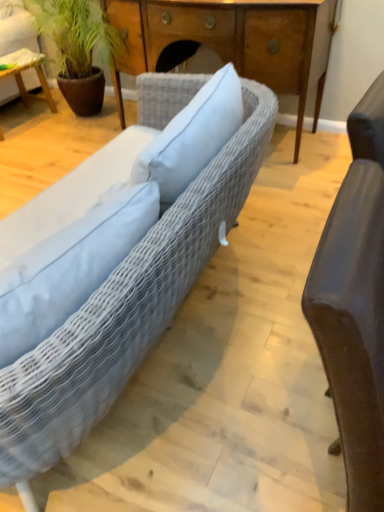
I want to click on vacant area on the back side of matte brown leather chair at right, so click(278, 297).